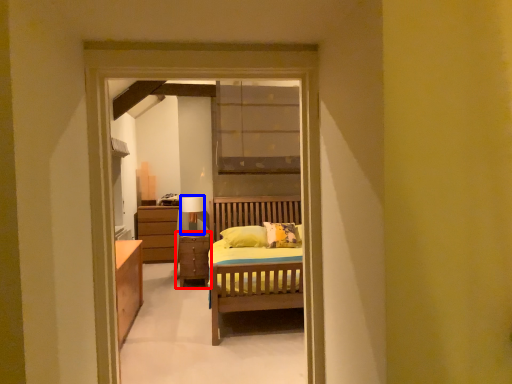
Question: Among these objects, which one is nearest to the camera, chest of drawers (highlighted by a red box) or table lamp (highlighted by a blue box)?

Choices:
 (A) chest of drawers
 (B) table lamp

Answer: (A)